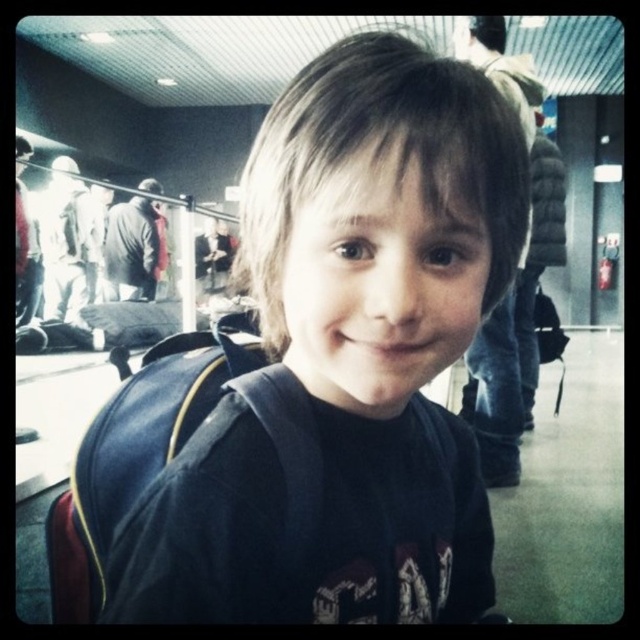
Is dark blue backpack at center behind matte black backpack at center?

No, dark blue backpack at center is closer to the viewer.

Does dark blue backpack at center appear on the right side of matte black backpack at center?

No, dark blue backpack at center is not to the right of matte black backpack at center.

Does point (500, 97) lie behind point (492, 316)?

No, (500, 97) is closer to viewer.

At what (x,y) coordinates should I click in order to perform the action: click on dark blue backpack at center. Please return your answer as a coordinate pair (x, y). The image size is (640, 640). Looking at the image, I should click on pyautogui.click(x=348, y=356).